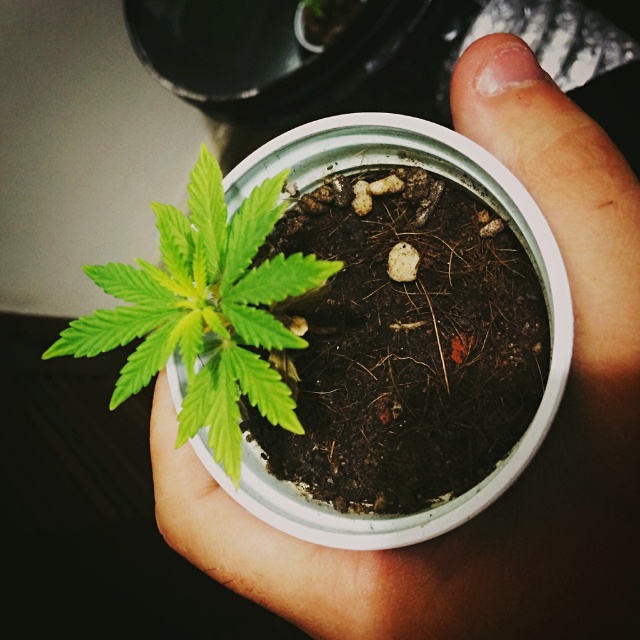
Question: Does smooth skin hand at center appear on the right side of green matte leafy plant at center?

Choices:
 (A) yes
 (B) no

Answer: (A)

Question: Does smooth skin hand at center appear on the left side of green matte leafy plant at center?

Choices:
 (A) no
 (B) yes

Answer: (A)

Question: Which object appears farthest from the camera in this image?

Choices:
 (A) smooth skin hand at center
 (B) green matte leafy plant at center

Answer: (A)

Question: Is smooth skin hand at center to the right of green matte leafy plant at center from the viewer's perspective?

Choices:
 (A) yes
 (B) no

Answer: (A)